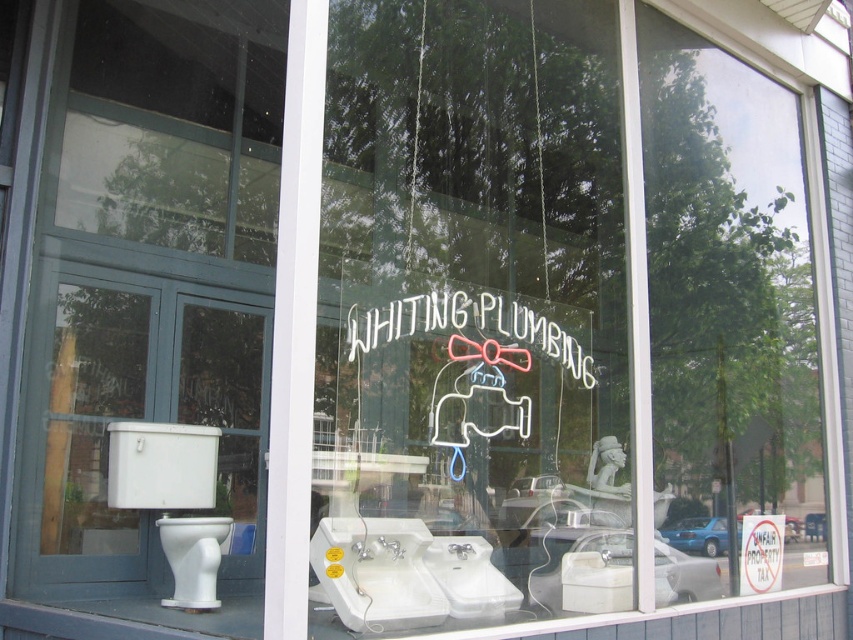
You are standing in front of the Whiting Plumbing storefront window. You notice two points marked on the window display. Which point is closer to you, point at coordinate (519, 310) or point at coordinate (773, 524)?

Point at coordinate (519, 310) is closer to the viewer than point at coordinate (773, 524).

You are a customer looking at the storefront window of Whiting Plumbing. You notice the neon sign at center and the white paper sign at center. Which one is wider?

The neon sign at center is wider than the white paper sign at center.

In the scene shown: You are standing outside the Whiting Plumbing store looking at the storefront window. There are two points marked on the window at coordinates point (193, 577) and point (759, 582). Which point is closer to you as you face the window?

Point (193, 577) is closer to you because it is in front of point (759, 582) in the window display.